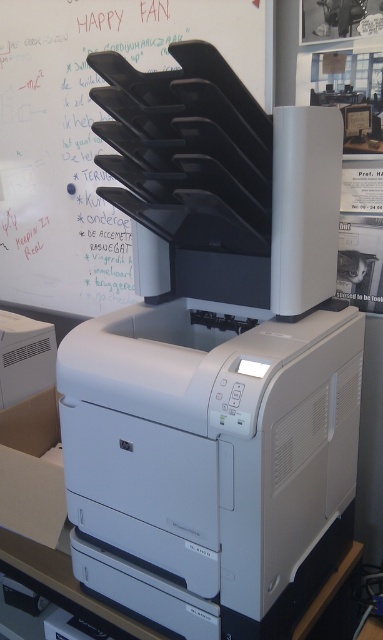
You are organizing an office space and need to determine which object is taller between the black plastic bulletin board at upper center and the cardboard box at lower left. Based on the scene description, which one is taller?

The black plastic bulletin board at upper center is taller than the cardboard box at lower left according to the description.

You are organizing an office space and need to move a cardboard box from its current position to a spot closer to the black plastic bulletin board. Based on the scene, can you determine if the cardboard box at lower left is currently behind or in front of the black plastic bulletin board at upper center?

The black plastic bulletin board at upper center is further to the viewer than the cardboard box at lower left, meaning the cardboard box at lower left is behind the bulletin board. Therefore, moving it closer to the bulletin board would require moving it forward towards the viewer.